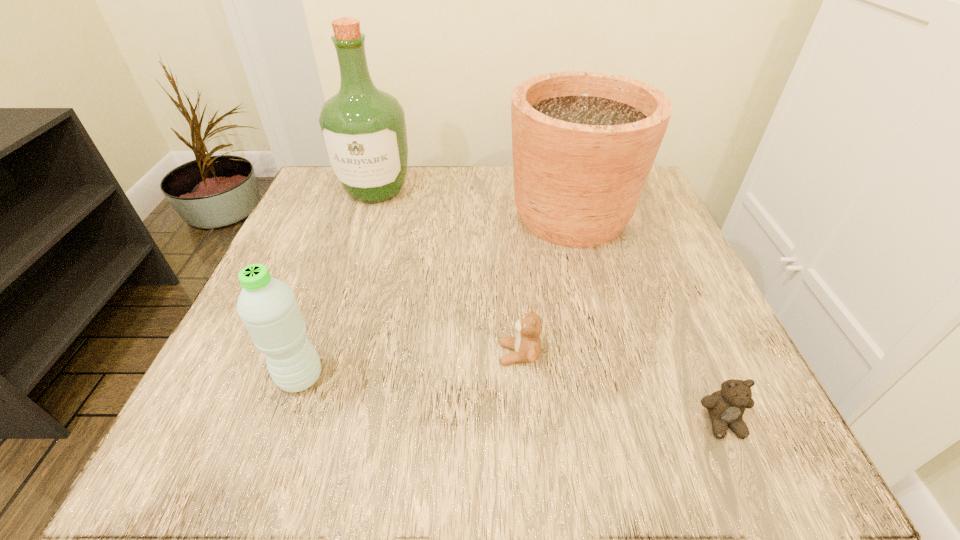
Find the location of a particular element. This screenshot has width=960, height=540. free area in between the tallest object and the right teddy bear is located at coordinates (549, 306).

I want to click on free area in between the water bottle and the tallest object, so click(338, 284).

Where is `free space between the tallest object and the nearest object`? The width and height of the screenshot is (960, 540). free space between the tallest object and the nearest object is located at coordinates (549, 306).

The image size is (960, 540). Identify the location of free space between the water bottle and the flowerpot. (436, 296).

The image size is (960, 540). I want to click on free spot between the second tallest object and the liquor, so click(x=473, y=202).

The width and height of the screenshot is (960, 540). Find the location of `vacant space in between the liquor and the flowerpot`. vacant space in between the liquor and the flowerpot is located at coordinates (473, 202).

Locate an element on the screen. The image size is (960, 540). free space between the farther teddy bear and the third shortest object is located at coordinates (410, 366).

The image size is (960, 540). Find the location of `vacant area between the third tallest object and the nearest object`. vacant area between the third tallest object and the nearest object is located at coordinates (512, 400).

Locate an element on the screen. The height and width of the screenshot is (540, 960). vacant area that lies between the liquor and the third tallest object is located at coordinates (338, 284).

Find the location of a particular element. The image size is (960, 540). object that is the fourth closest one to the flowerpot is located at coordinates (268, 308).